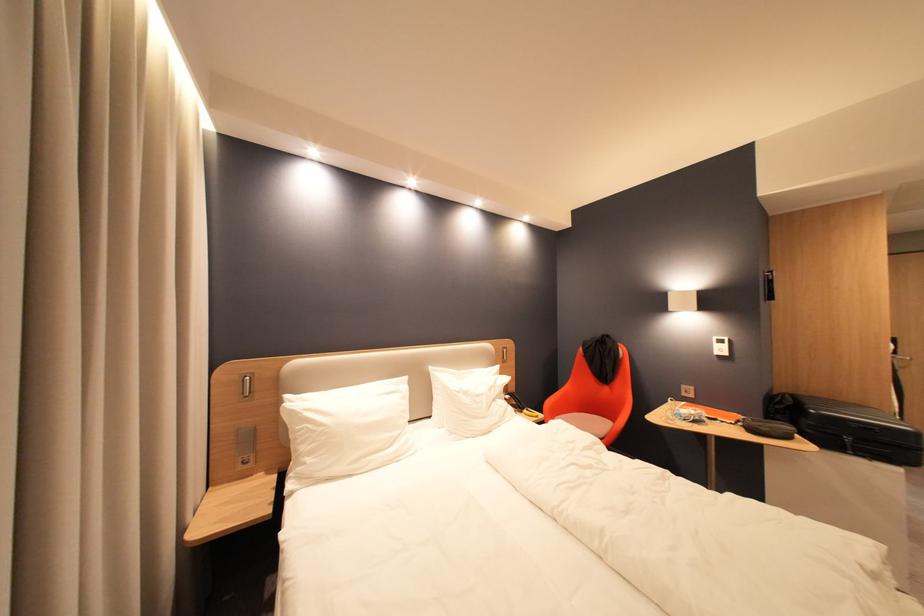
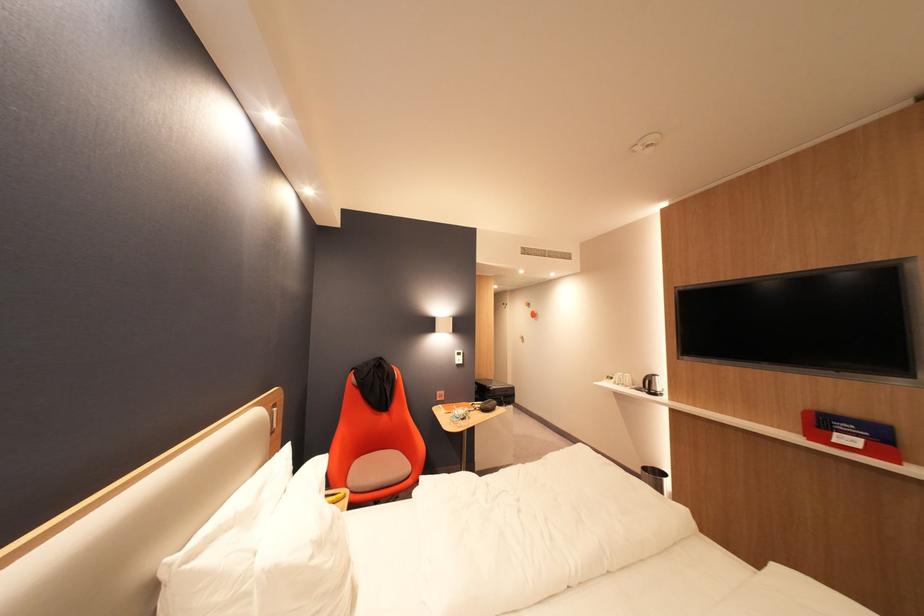
Where in the second image is the point corresponding to point (476, 395) from the first image?

(330, 545)